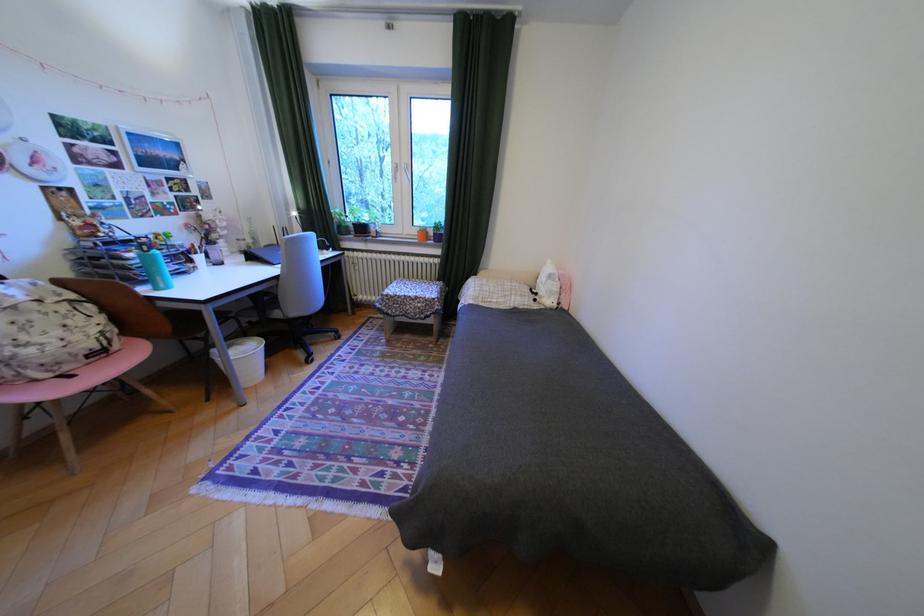
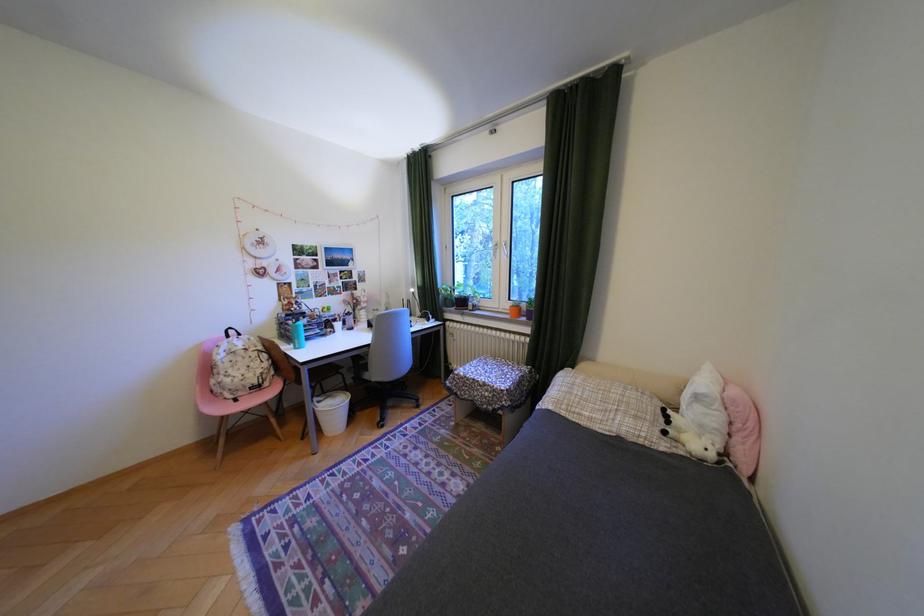
Find the pixel in the second image that matches [79,368] in the first image.

(251, 394)